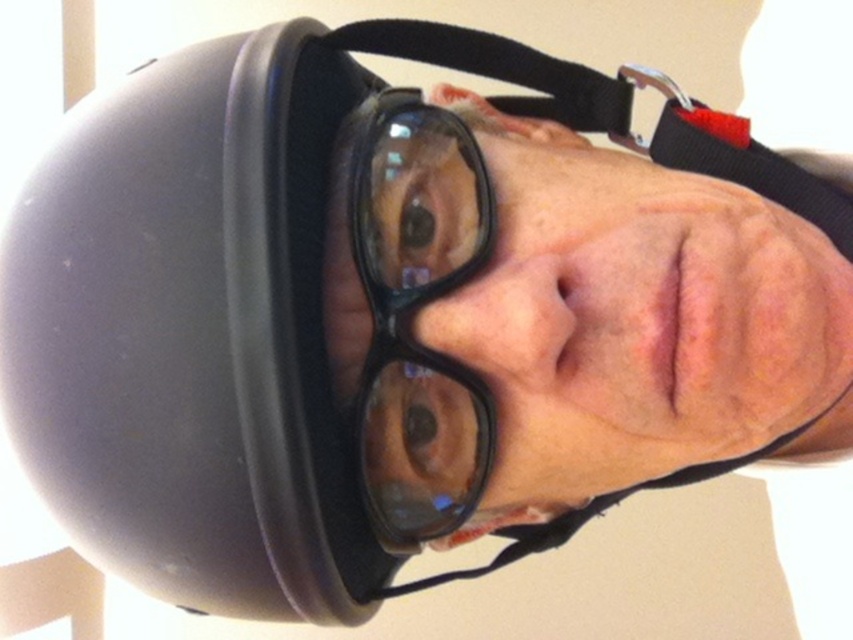
Question: Can you confirm if black plastic glasses at center is positioned to the left of black plastic strap at upper center?

Choices:
 (A) yes
 (B) no

Answer: (A)

Question: Does black plastic glasses at center have a lesser width compared to black plastic strap at upper center?

Choices:
 (A) no
 (B) yes

Answer: (B)

Question: Is black plastic glasses at center above black plastic strap at upper center?

Choices:
 (A) yes
 (B) no

Answer: (B)

Question: Which of the following is the farthest from the observer?

Choices:
 (A) (424, 52)
 (B) (477, 460)

Answer: (A)